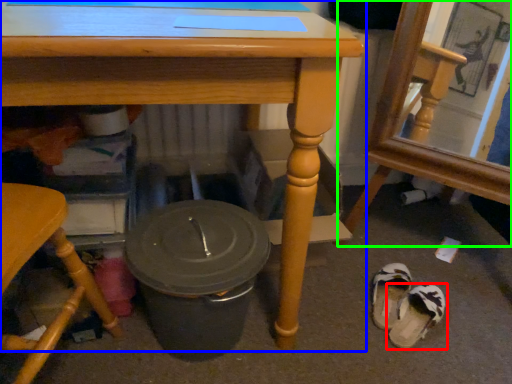
Question: Which object is the closest to the footwear (highlighted by a red box)? Choose among these: table (highlighted by a blue box) or chair (highlighted by a green box).

Choices:
 (A) table
 (B) chair

Answer: (B)